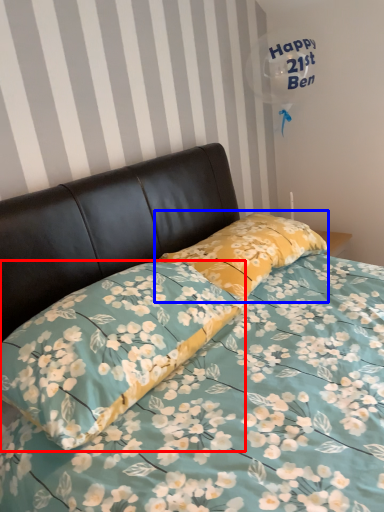
Question: Which point is closer to the camera, pillow (highlighted by a red box) or pillow (highlighted by a blue box)?

Choices:
 (A) pillow
 (B) pillow

Answer: (A)